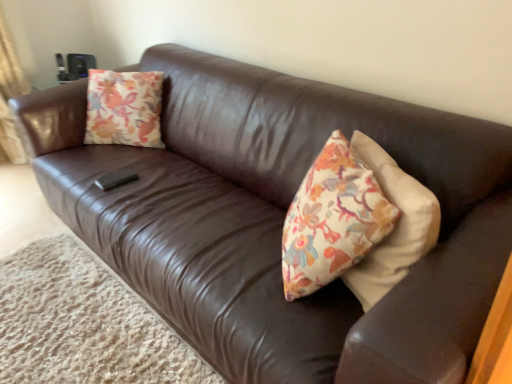
Question: From a real-world perspective, relative to brown leather couch at lower left, is floral-patterned fabric pillow at upper left vertically above or below?

Choices:
 (A) above
 (B) below

Answer: (A)

Question: Is floral-patterned fabric pillow at upper left bigger or smaller than brown leather couch at lower left?

Choices:
 (A) small
 (B) big

Answer: (A)

Question: Is floral-patterned fabric pillow at upper left in front of or behind brown leather couch at lower left in the image?

Choices:
 (A) behind
 (B) front

Answer: (A)

Question: Is point (20, 288) positioned closer to the camera than point (153, 124)?

Choices:
 (A) farther
 (B) closer

Answer: (B)

Question: Would you say brown leather couch at lower left is inside or outside floral-patterned fabric pillow at upper left?

Choices:
 (A) outside
 (B) inside

Answer: (A)

Question: From a real-world perspective, is brown leather couch at lower left physically located above or below floral-patterned fabric pillow at upper left?

Choices:
 (A) above
 (B) below

Answer: (B)

Question: In terms of height, does brown leather couch at lower left look taller or shorter compared to floral-patterned fabric pillow at upper left?

Choices:
 (A) short
 (B) tall

Answer: (A)